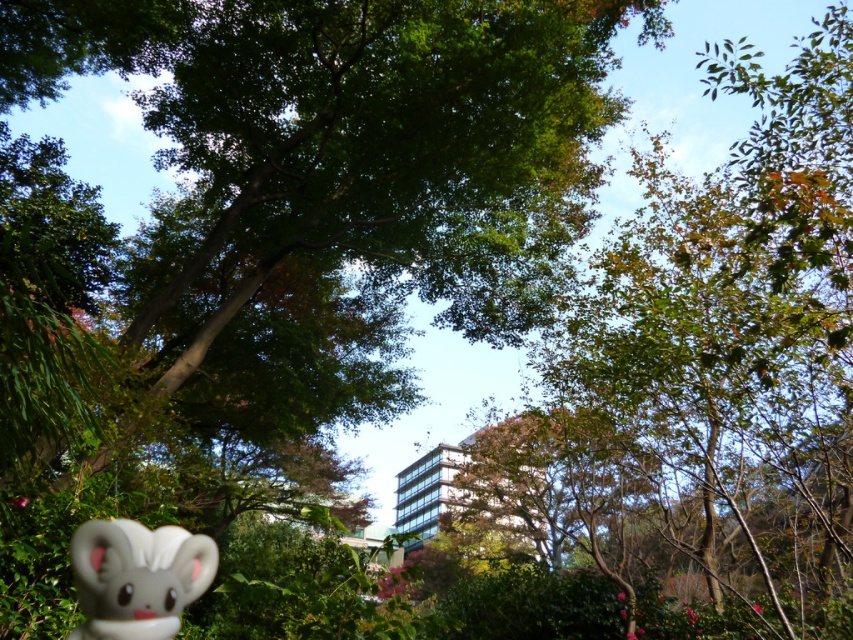
Is green leafy tree at center further to the viewer compared to white matte plush toy at lower left?

Yes, green leafy tree at center is behind white matte plush toy at lower left.

Does green leafy tree at center appear under white matte plush toy at lower left?

Incorrect, green leafy tree at center is not positioned below white matte plush toy at lower left.

Identify the location of green leafy tree at center. (347, 148).